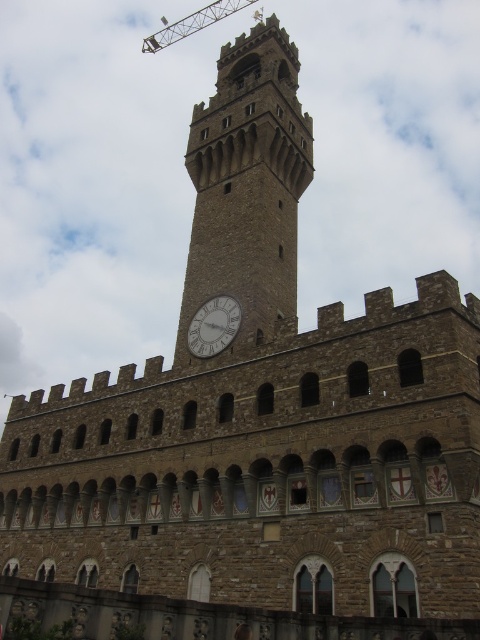
Does stone clock tower at center have a lesser height compared to white stone clock at center?

In fact, stone clock tower at center may be taller than white stone clock at center.

Can you confirm if stone clock tower at center is bigger than white stone clock at center?

Yes, stone clock tower at center is bigger than white stone clock at center.

This screenshot has height=640, width=480. Identify the location of stone clock tower at center. (247, 186).

Is the position of white stone clock at center more distant than that of metallic construction crane at upper center?

No, it is in front of metallic construction crane at upper center.

The width and height of the screenshot is (480, 640). In order to click on white stone clock at center in this screenshot , I will do (214, 326).

The height and width of the screenshot is (640, 480). Describe the element at coordinates (214, 326) in the screenshot. I see `white stone clock at center` at that location.

This screenshot has height=640, width=480. What are the coordinates of `white stone clock at center` in the screenshot? It's located at (214, 326).

Is stone clock tower at center thinner than metallic construction crane at upper center?

Yes, stone clock tower at center is thinner than metallic construction crane at upper center.

Can you confirm if stone clock tower at center is positioned above metallic construction crane at upper center?

No, stone clock tower at center is not above metallic construction crane at upper center.

Image resolution: width=480 pixels, height=640 pixels. Find the location of `stone clock tower at center`. stone clock tower at center is located at coordinates (247, 186).

Identify the location of stone clock tower at center. Image resolution: width=480 pixels, height=640 pixels. pyautogui.click(x=247, y=186).